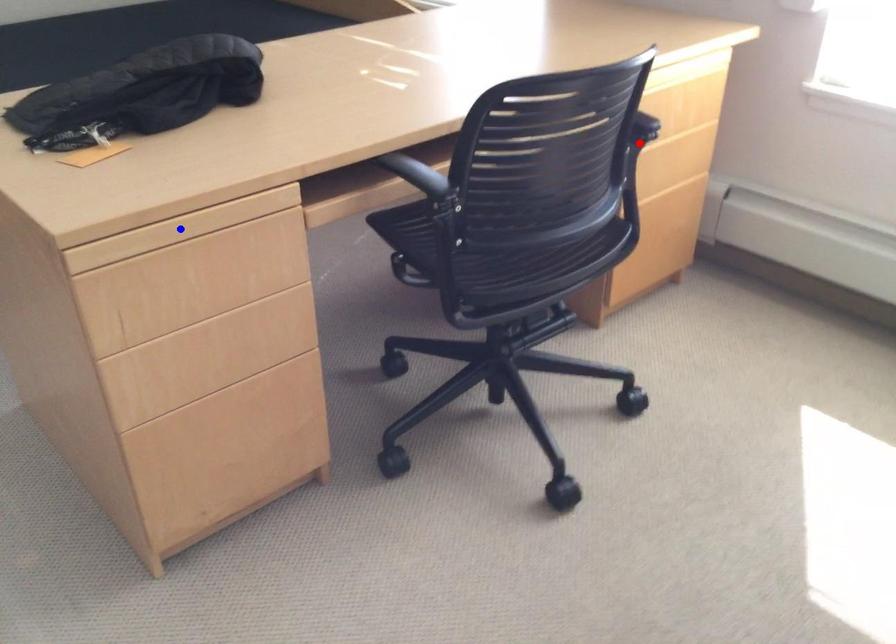
Question: Which of the two points in the image is closer to the camera?

Choices:
 (A) Blue point is closer.
 (B) Red point is closer.

Answer: (A)